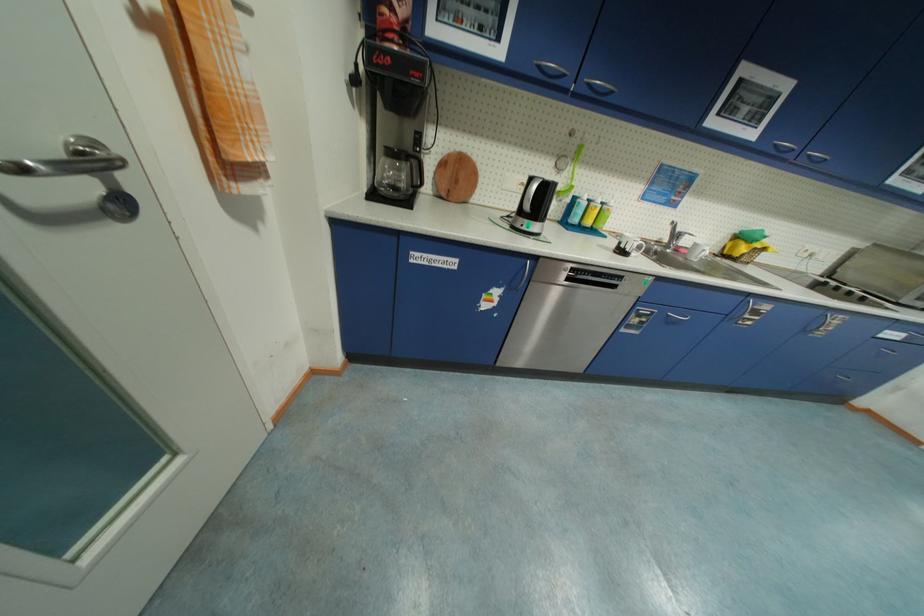
Where would you lift the electric kettle handle? Please return your answer as a coordinate pair (x, y).

(529, 193)